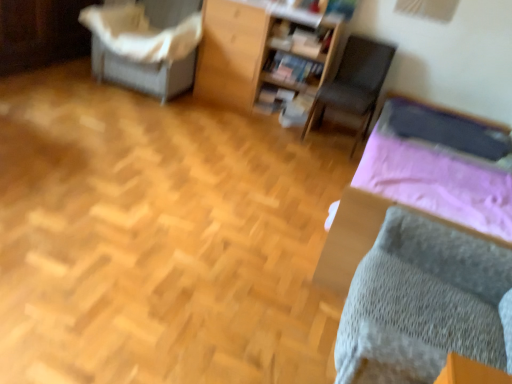
Where is `free space in front of dark gray fabric chair at center`? The width and height of the screenshot is (512, 384). free space in front of dark gray fabric chair at center is located at coordinates (316, 153).